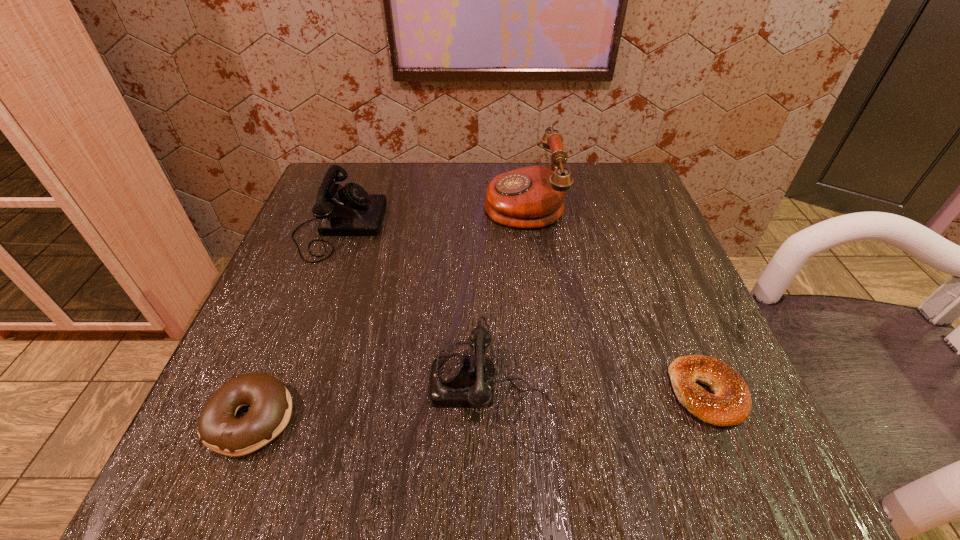
This screenshot has height=540, width=960. In order to click on the tallest object in this screenshot , I will do `click(531, 197)`.

I want to click on the second tallest telephone, so click(349, 210).

I want to click on the second tallest object, so click(x=349, y=210).

Identify the location of the nearest telephone. (455, 381).

Find the location of `the third shortest object`. the third shortest object is located at coordinates (455, 381).

Locate an element on the screen. doughnut is located at coordinates (270, 402).

Image resolution: width=960 pixels, height=540 pixels. What are the coordinates of `the rightmost object` in the screenshot? It's located at (731, 404).

Locate an element on the screen. the shortest object is located at coordinates (731, 404).

Identify the location of blank space located on the dial of the tallest object. The image size is (960, 540). (321, 201).

You are a GUI agent. You are given a task and a screenshot of the screen. Output one action in this format:
    pyautogui.click(x=<x>, y=<y>)
    Task: Click on the free space located on the dial of the tallest object
    This screenshot has height=540, width=960.
    Given the screenshot: What is the action you would take?
    pyautogui.click(x=434, y=201)